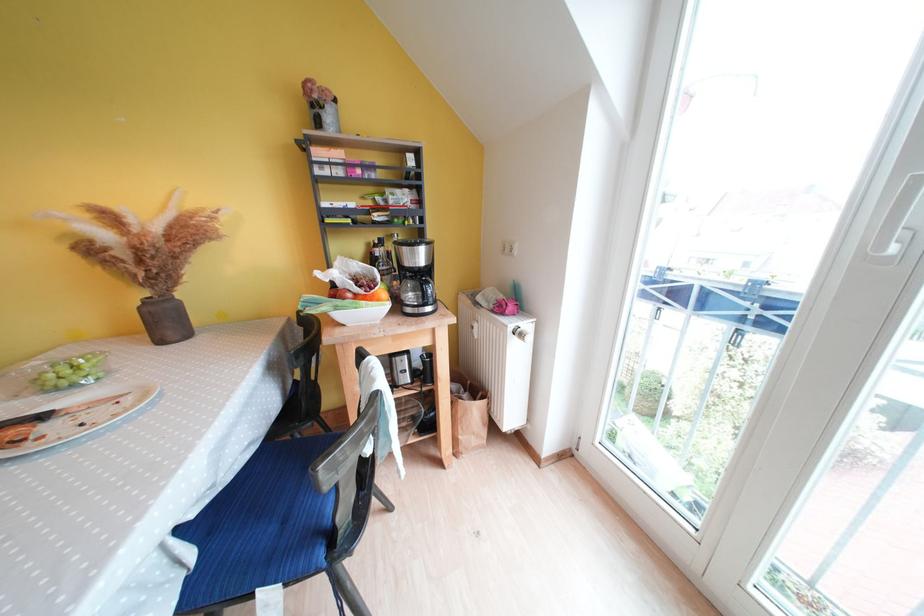
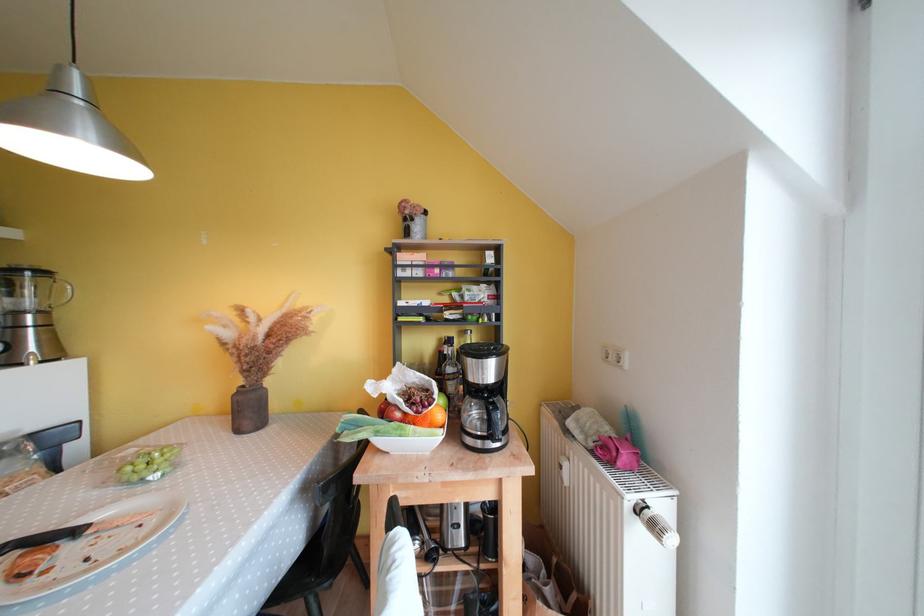
Based on the continuous images, in which direction is the camera rotating?

The camera's rotation is toward left-up.